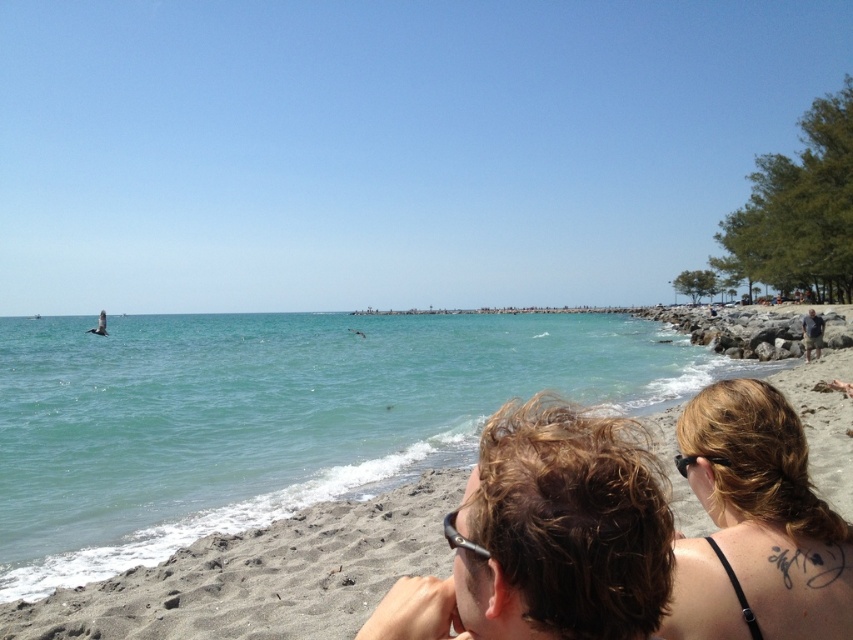
Question: Does dark blonde hair at upper right appear under dark gray shorts at right?

Choices:
 (A) no
 (B) yes

Answer: (B)

Question: Can you confirm if brown hair at center is smaller than dark blonde hair at upper right?

Choices:
 (A) yes
 (B) no

Answer: (A)

Question: Which point is closer to the camera?

Choices:
 (A) (474, 490)
 (B) (764, 596)
 (C) (351, 432)
 (D) (805, 328)

Answer: (A)

Question: Is dark blonde hair at upper right smaller than dark gray shorts at right?

Choices:
 (A) no
 (B) yes

Answer: (B)

Question: Which object appears closest to the camera in this image?

Choices:
 (A) clear blue water at center
 (B) dark gray shorts at right
 (C) dark blonde hair at upper right
 (D) brown hair at center

Answer: (D)

Question: Which point is farther to the camera?

Choices:
 (A) (239, 378)
 (B) (809, 323)

Answer: (A)